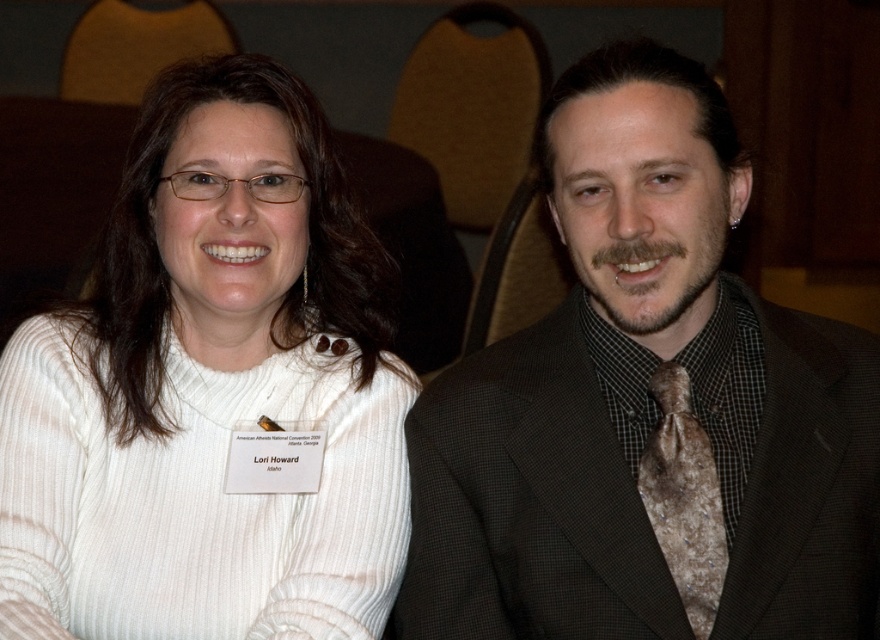
Is white ribbed sweater at left taller than brown textured tie at right?

Correct, white ribbed sweater at left is much taller as brown textured tie at right.

Who is more distant from viewer, (391,461) or (673,564)?

Point (391,461)

Where is `white ribbed sweater at left`? white ribbed sweater at left is located at coordinates (209, 388).

Describe the element at coordinates (649, 408) in the screenshot. I see `brown textured suit at center` at that location.

Is point (639, 179) positioned in front of point (687, 436)?

Yes, point (639, 179) is in front of point (687, 436).

The height and width of the screenshot is (640, 880). In order to click on brown textured suit at center in this screenshot , I will do `click(649, 408)`.

Between brown textured suit at center and white ribbed sweater at left, which one is positioned lower?

white ribbed sweater at left is lower down.

Can you confirm if brown textured suit at center is taller than white ribbed sweater at left?

In fact, brown textured suit at center may be shorter than white ribbed sweater at left.

Which is behind, point (512, 477) or point (180, 360)?

The point (180, 360) is behind.

What are the coordinates of `brown textured suit at center` in the screenshot? It's located at (649, 408).